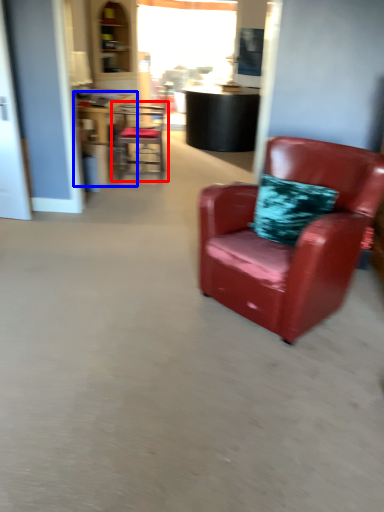
Question: Which of the following is the farthest to the observer, chair (highlighted by a red box) or table (highlighted by a blue box)?

Choices:
 (A) chair
 (B) table

Answer: (A)